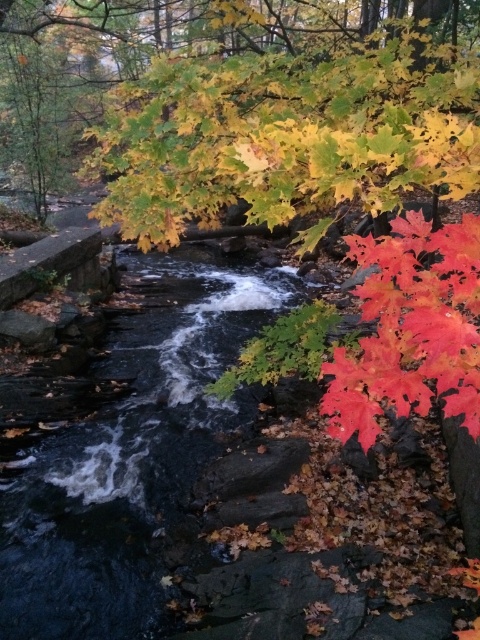
You are planning to cross the stream using a small wooden plank. The plank is exactly as long as the bright red maple leaf at lower right. Do you think the plank will be long enough to safely cross the dark gray stone stream at center?

The dark gray stone stream at center is much taller than the bright red maple leaf at lower right. Since the plank is only as long as the leaf, it won me be long enough to safely cross the stream.

You are standing at the edge of the forest and want to cross the stream. The dark gray stone stream at center is your only path. If your backpack has a width of 2 feet, can you safely cross the stream without getting your backpack wet?

The dark gray stone stream at center is 9.86 feet from viewer. Since the stream is 9.86 feet away, you can approach it safely. However, the question about the backpack width doesn not relate to the stream width or distance provided. The given information only states the distance from the viewer to the stream, not the stream s width. Therefore, the backpack width of 2 feet cannot be used to determine if it will fit across the stream without more details about the stream s width.

Looking at this image, you are an artist trying to paint the autumn scene. You want to ensure the vivid red maple leaf at right is visible in your painting. Given the dark gray stone stream at center, should you paint the leaf in front of or behind the stream?

The vivid red maple leaf at right is behind the dark gray stone stream at center, so to make it visible, you should paint the leaf in front of the stream.